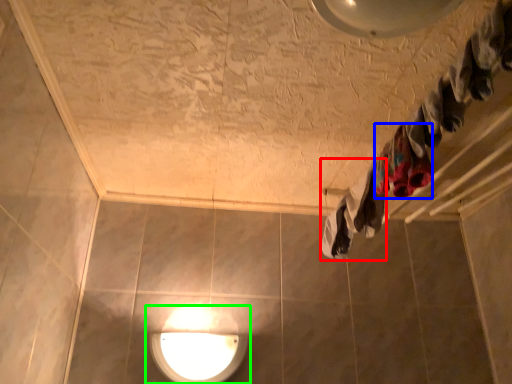
Question: Based on their relative distances, which object is nearer to clothing (highlighted by a red box)? Choose from clothing (highlighted by a blue box) and lamp (highlighted by a green box).

Choices:
 (A) clothing
 (B) lamp

Answer: (A)